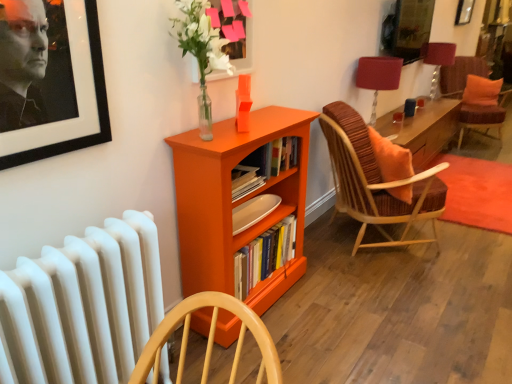
Where is `vacant point to the right of orange matte bookcase at center`? The image size is (512, 384). vacant point to the right of orange matte bookcase at center is located at coordinates (343, 309).